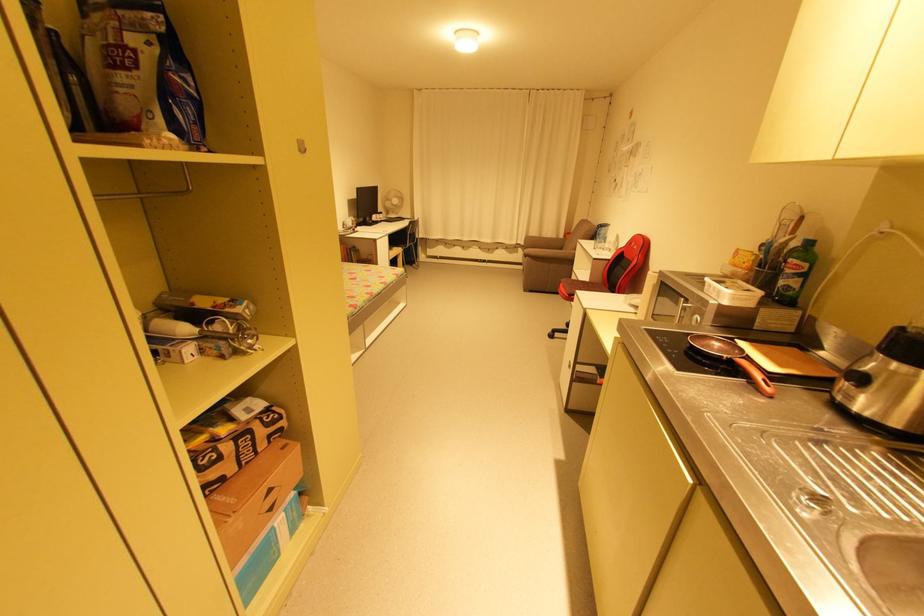
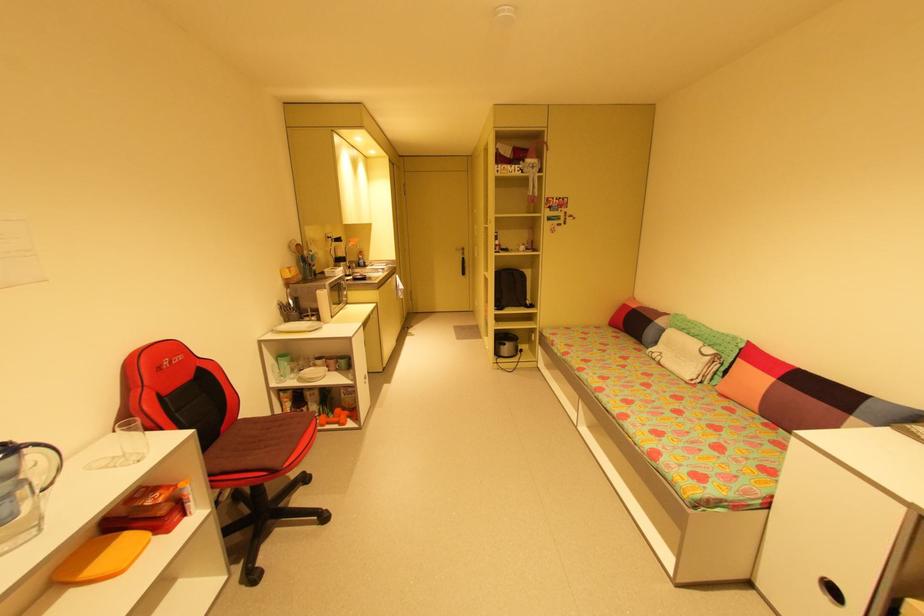
Locate, in the second image, the point that corresponds to pixel 392 284 in the first image.

(625, 422)